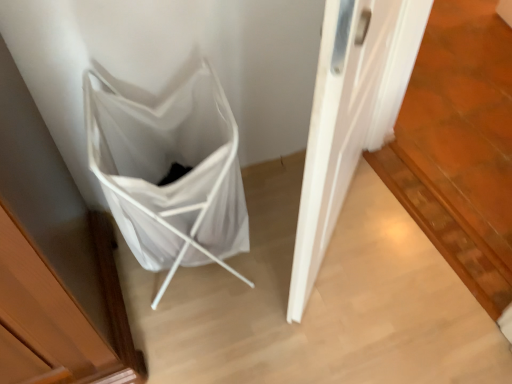
Describe the element at coordinates (350, 115) in the screenshot. I see `white matte door at center` at that location.

Locate an element on the screen. This screenshot has width=512, height=384. white matte door at center is located at coordinates (350, 115).

Identify the location of white fabric folding chair at lower left. [x=167, y=171].

Describe the element at coordinates (167, 171) in the screenshot. This screenshot has width=512, height=384. I see `white fabric folding chair at lower left` at that location.

In order to face white fabric folding chair at lower left, should I rotate leftwards or rightwards?

Rotate left and turn 9.768 degrees.

Find the location of `white matte door at center`. white matte door at center is located at coordinates (350, 115).

Which is more to the left, white fabric folding chair at lower left or white matte door at center?

white fabric folding chair at lower left.

Looking at this image, is white fabric folding chair at lower left behind white matte door at center?

A: Yes.

Does point (214, 260) lie behind point (348, 56)?

Yes, point (214, 260) is farther from viewer.

From the image's perspective, which is below, white fabric folding chair at lower left or white matte door at center?

white fabric folding chair at lower left, from the image's perspective.

From a real-world perspective, relative to white matte door at center, is white fabric folding chair at lower left vertically above or below?

Clearly, from a real-world perspective, white fabric folding chair at lower left is below white matte door at center.

Is white fabric folding chair at lower left wider or thinner than white matte door at center?

Considering their sizes, white fabric folding chair at lower left looks broader than white matte door at center.

Looking at this image, which of these two, white fabric folding chair at lower left or white matte door at center, stands shorter?

Standing shorter between the two is white fabric folding chair at lower left.

Is white fabric folding chair at lower left smaller than white matte door at center?

Yes, white fabric folding chair at lower left is smaller than white matte door at center.

Is white fabric folding chair at lower left inside or outside of white matte door at center?

The correct answer is: outside.

Would you consider white fabric folding chair at lower left to be distant from white matte door at center?

Actually, white fabric folding chair at lower left and white matte door at center are a little close together.

Could you tell me if white fabric folding chair at lower left is facing white matte door at center?

No, white fabric folding chair at lower left is not aimed at white matte door at center.

How different are the orientations of white fabric folding chair at lower left and white matte door at center in degrees?

The facing directions of white fabric folding chair at lower left and white matte door at center are 46.8 degrees apart.

Locate an element on the screen. folding chair behind the white matte door at center is located at coordinates (167, 171).

Can you confirm if white matte door at center is positioned to the left of white fabric folding chair at lower left?

No, white matte door at center is not to the left of white fabric folding chair at lower left.

Relative to white fabric folding chair at lower left, is white matte door at center in front or behind?

Visually, white matte door at center is located in front of white fabric folding chair at lower left.

Does point (312, 211) come farther from viewer compared to point (163, 224)?

No, (312, 211) is in front of (163, 224).

From the image's perspective, which object appears higher, white matte door at center or white fabric folding chair at lower left?

From the image's view, white matte door at center is above.

From a real-world perspective, is white matte door at center physically located above or below white fabric folding chair at lower left?

From a real-world perspective, white matte door at center is physically above white fabric folding chair at lower left.

From the picture: Which object is thinner, white matte door at center or white fabric folding chair at lower left?

white matte door at center.

Can you confirm if white matte door at center is shorter than white fabric folding chair at lower left?

No, white matte door at center is not shorter than white fabric folding chair at lower left.

Is white matte door at center bigger or smaller than white fabric folding chair at lower left?

white matte door at center is bigger than white fabric folding chair at lower left.

Would you say white matte door at center is inside or outside white fabric folding chair at lower left?

white matte door at center is not enclosed by white fabric folding chair at lower left.

Is white matte door at center far away from white fabric folding chair at lower left?

No.

Could you tell me if white matte door at center is turned towards white fabric folding chair at lower left?

No, white matte door at center is not oriented towards white fabric folding chair at lower left.

Identify the location of folding chair lying on the left of white matte door at center. This screenshot has width=512, height=384. (167, 171).

Locate an element on the screen. The height and width of the screenshot is (384, 512). door that appears in front of the white fabric folding chair at lower left is located at coordinates (350, 115).

At what (x,y) coordinates should I click in order to perform the action: click on folding chair behind the white matte door at center. Please return your answer as a coordinate pair (x, y). The height and width of the screenshot is (384, 512). Looking at the image, I should click on (167, 171).